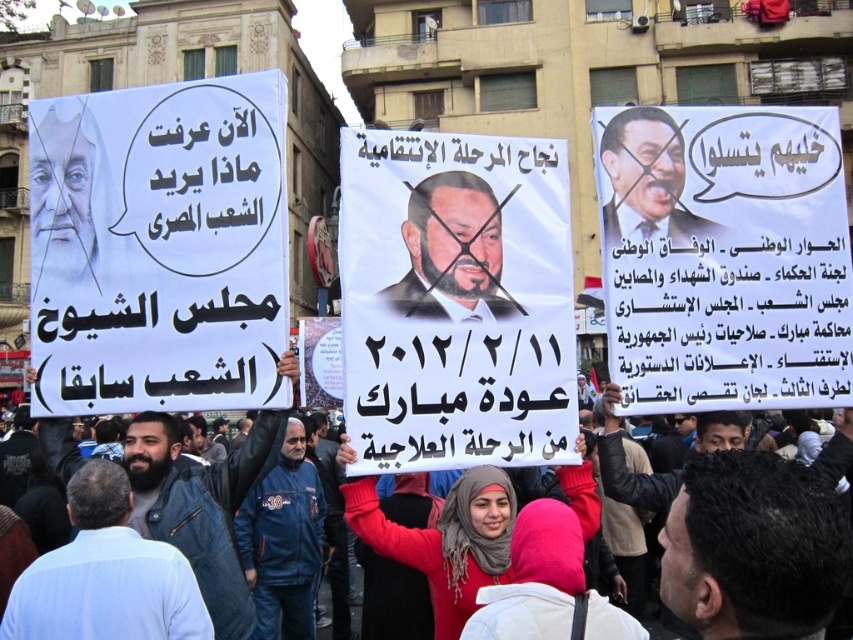
Question: Which point is closer to the camera?

Choices:
 (A) blue fabric jacket at center
 (B) red fabric hijab at center

Answer: (B)

Question: Which point is closer to the camera?

Choices:
 (A) (798, 544)
 (B) (4, 627)
 (C) (596, 179)

Answer: (A)

Question: Where is denim jacket at center located in relation to blue fabric jacket at center in the image?

Choices:
 (A) right
 (B) left

Answer: (B)

Question: Which point appears closest to the camera in this image?

Choices:
 (A) (814, 509)
 (B) (355, 360)
 (C) (318, 509)
 (D) (473, 608)

Answer: (A)

Question: Can you confirm if denim jacket at lower left is positioned below denim jacket at center?

Choices:
 (A) no
 (B) yes

Answer: (B)

Question: Observing the image, what is the correct spatial positioning of dark brown paper at center in reference to matte black poster at upper right?

Choices:
 (A) below
 (B) above

Answer: (A)